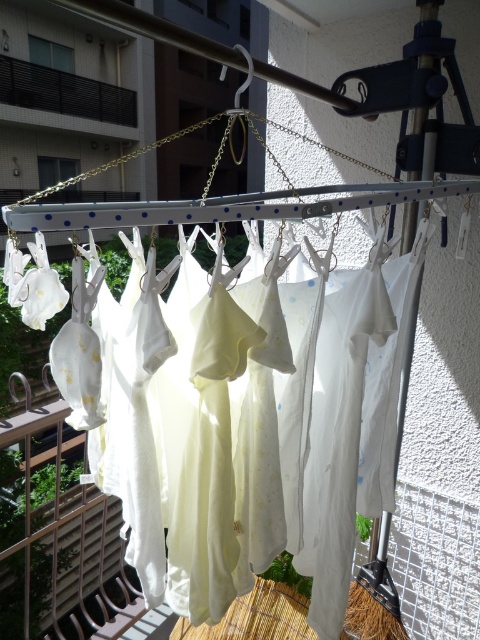
Question: Considering the relative positions of white cotton shirts at center and black metal railing at upper left in the image provided, where is white cotton shirts at center located with respect to black metal railing at upper left?

Choices:
 (A) below
 (B) above

Answer: (A)

Question: Which object is farther from the camera taking this photo?

Choices:
 (A) black metal railing at upper left
 (B) white cotton shirts at center

Answer: (A)

Question: Can you confirm if white cotton shirts at center is positioned above black metal railing at upper left?

Choices:
 (A) no
 (B) yes

Answer: (A)

Question: Which object appears farthest from the camera in this image?

Choices:
 (A) black metal railing at upper left
 (B) white cotton shirts at center

Answer: (A)

Question: Does white cotton shirts at center have a larger size compared to black metal railing at upper left?

Choices:
 (A) no
 (B) yes

Answer: (A)